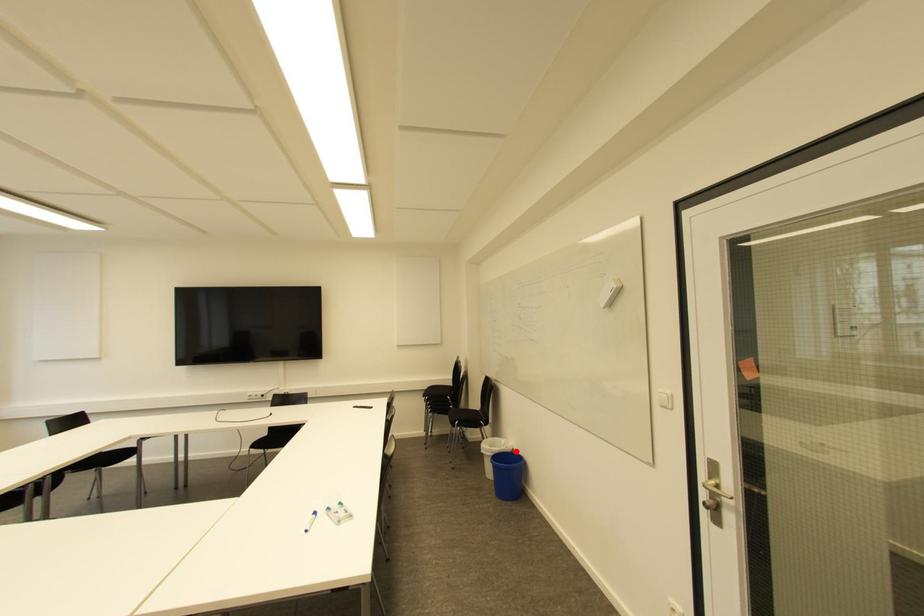
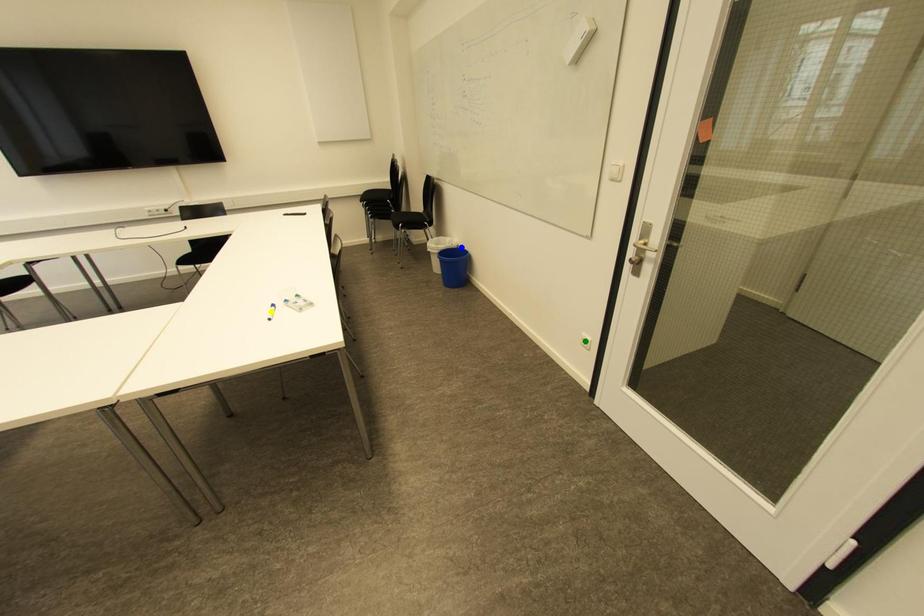
Question: I am providing you with two images of the same scene from different viewpoints. A red point is marked on the first image. You are given multiple points on the second image. Which mark in image 2 goes with the point in image 1?

Choices:
 (A) yellow point
 (B) green point
 (C) blue point

Answer: (C)